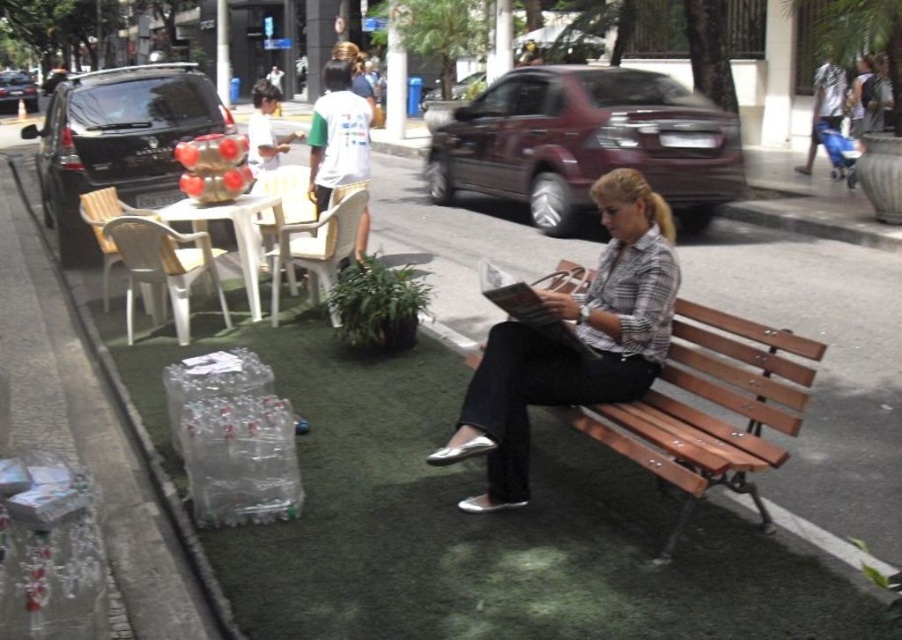
You are a photographer trying to capture the scene with the plaid fabric shirt at center and the wooden bench at center. Based on their positions, which object should you focus on first if you want to include both in your shot without moving the camera?

The plaid fabric shirt at center is to the left of the wooden bench at center, so you should focus on the plaid fabric shirt at center first to ensure both are in frame.

You are standing at the entrance of the urban street scene and need to locate the plaid fabric shirt at center. According to the coordinates provided, in which direction should you look to find it?

The plaid fabric shirt at center is located at point coordinates, so you should look towards the center of the image as per the coordinates given.